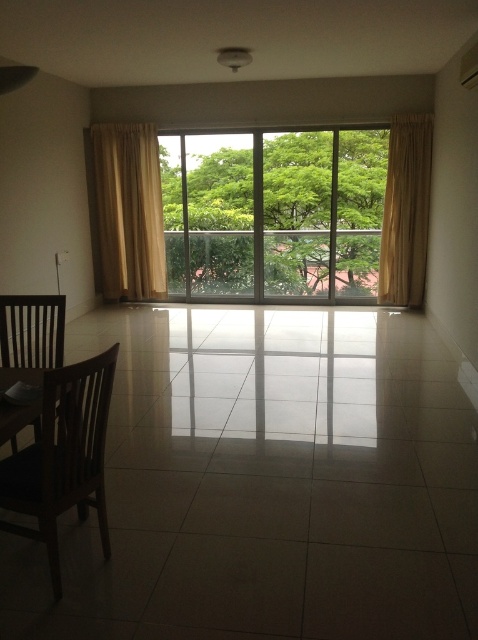
You are a delivery person carrying a large package that measures 1.2 meters in width. You need to move it through the space between the clear glass window at center and the beige fabric curtain at left. Can the package fit through this space without bending or damaging the curtain?

The distance between the clear glass window at center and the beige fabric curtain at left is 1.05 meters, which is narrower than the 1.2 meter width of the package. Therefore, the package cannot fit through this space without bending or damaging the curtain.

You are standing in the dining area and want to check the position of the beige fabric curtain at left. Where exactly is it located in the room?

The beige fabric curtain at left is located at point (129, 211) in the room.

You are standing in the dining area and want to look outside through the clear glass window at center. To do this, you need to move the brown wooden chair at left. Is the chair currently blocking your view of the window?

The clear glass window at center is positioned over the brown wooden chair at left, meaning the chair is directly beneath the window. Therefore, moving the chair would allow an unobstructed view through the window.